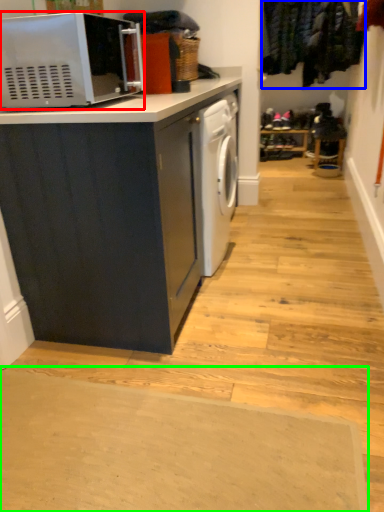
Question: Which is farther away from microwave oven (highlighted by a red box)? laundry (highlighted by a blue box) or doormat (highlighted by a green box)?

Choices:
 (A) laundry
 (B) doormat

Answer: (A)